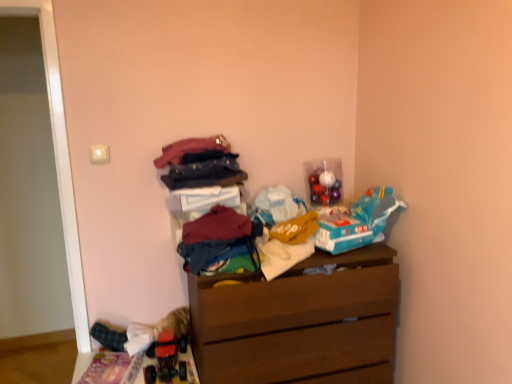
The width and height of the screenshot is (512, 384). Identify the location of empty space that is ontop of multicolored fabric pile at center, acting as the 1th clothing starting from the bottom. (220, 227).